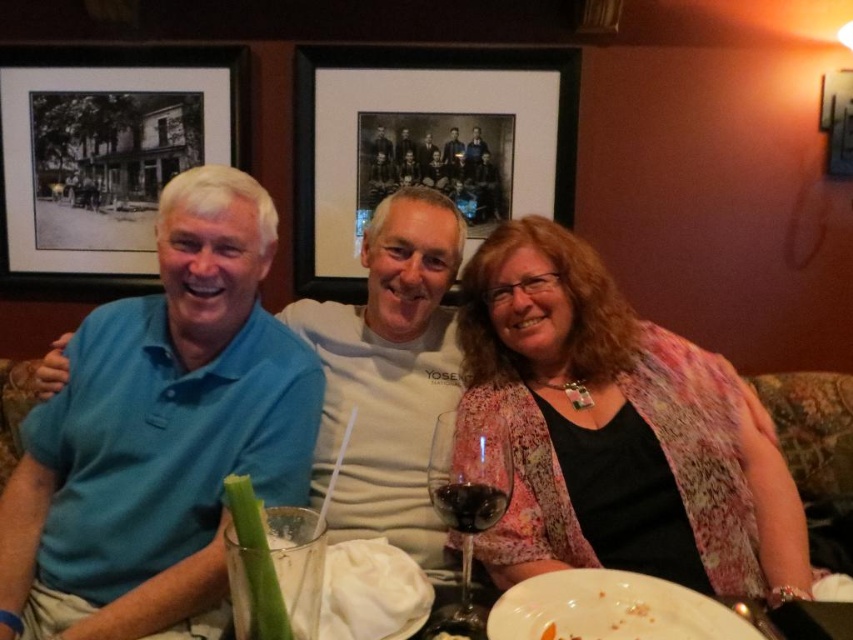
Consider the image. You are standing in the restaurant and want to take a photo of the three people seated at the table. The camera you are using has a focal length of 50mm. According to the rule of thirds, where should you position the point at coordinates point (335, 252) to ensure the best composition? Remember, the point is 7.61 feet away from you.

The point at coordinates point (335, 252) is 7.61 feet away from the viewer. To apply the rule of thirds, position the point at the intersection of the grid lines, which are typically located at 1.333 coordinates in both horizontal and vertical directions. However, since the point is already at approximately 0.394 coordinates, it may not align perfectly with the rule of thirds grid. Adjust the camera angle or subject positioning to bring the point closer to the intersection points for optimal composition.

From the picture: What is the color of the clothing worn by the person located at the coordinates point (619, 433)?

The point (619, 433) corresponds to the matte blue shirt at left.